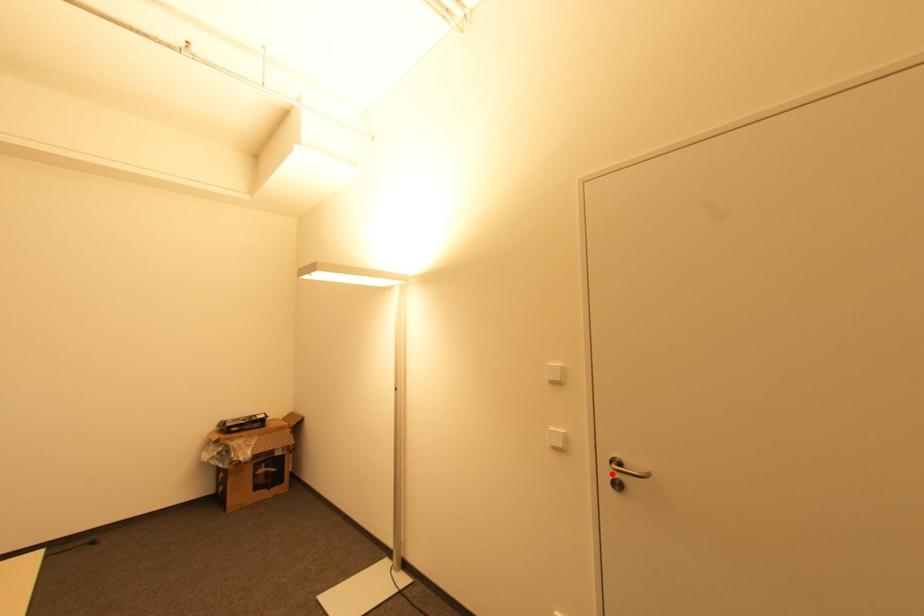
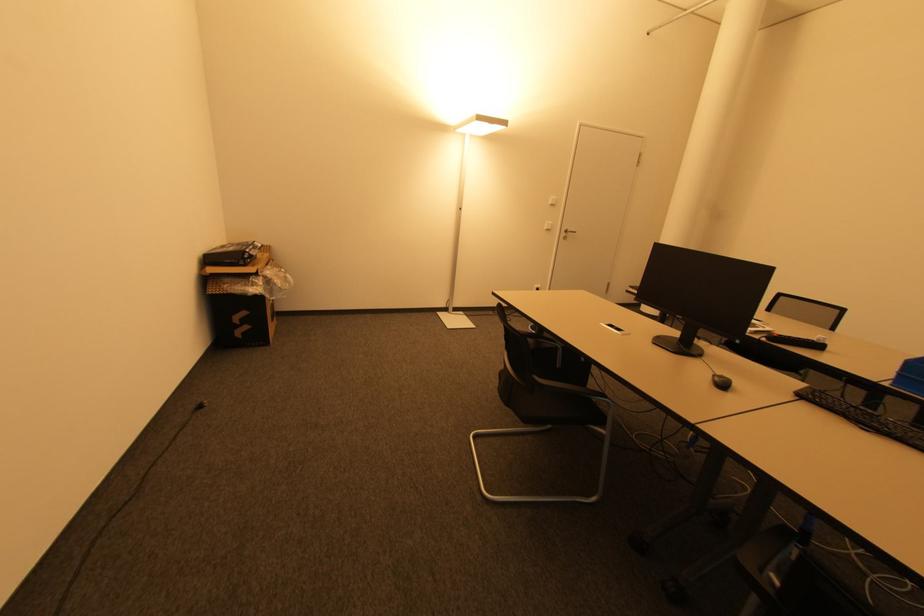
In the second image, find the point that corresponds to the highlighted location in the first image.

(565, 235)